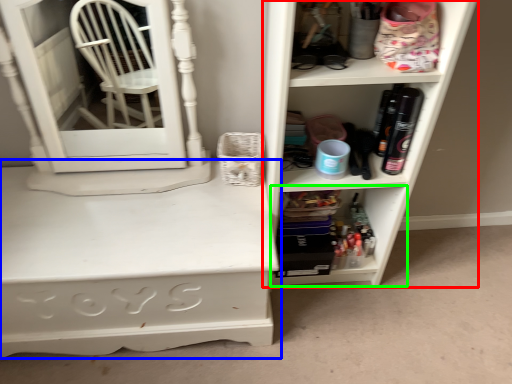
Question: Which object is positioned farthest from shelf (highlighted by a red box)? Select from desk (highlighted by a blue box) and shelf (highlighted by a green box).

Choices:
 (A) desk
 (B) shelf

Answer: (A)